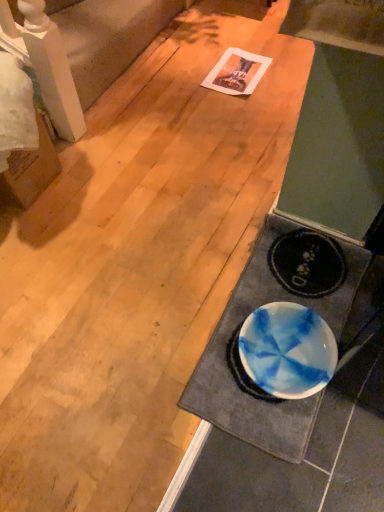
You are a GUI agent. You are given a task and a screenshot of the screen. Output one action in this format:
    pyautogui.click(x=<x>, y=<y>)
    Task: Click on the free location to the left of white glossy bowl at lower right
    
    Given the screenshot: What is the action you would take?
    (124, 332)